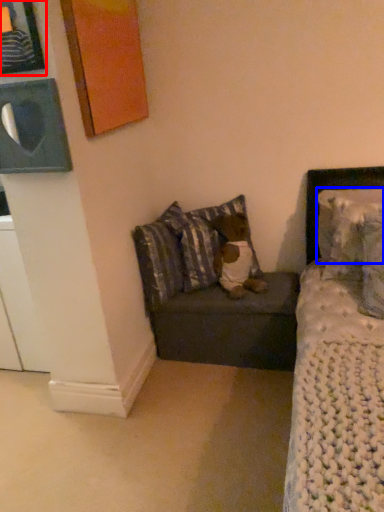
Question: Which of the following is the closest to the observer, picture frame (highlighted by a red box) or pillow (highlighted by a blue box)?

Choices:
 (A) picture frame
 (B) pillow

Answer: (A)